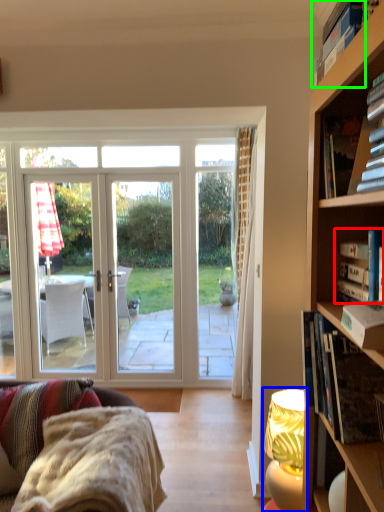
Question: Which object is positioned closest to book (highlighted by a red box)? Select from lamp (highlighted by a blue box) and book (highlighted by a green box).

Choices:
 (A) lamp
 (B) book

Answer: (B)